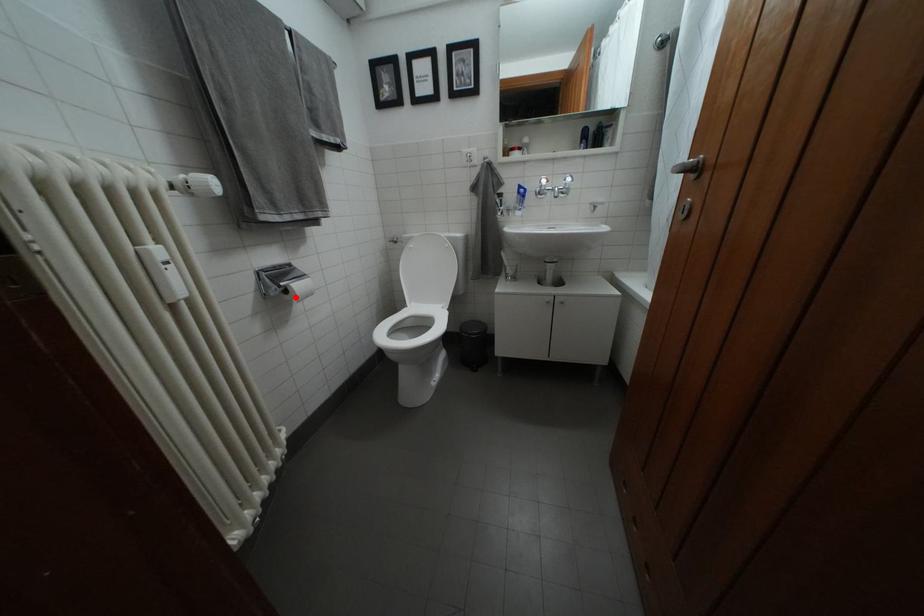
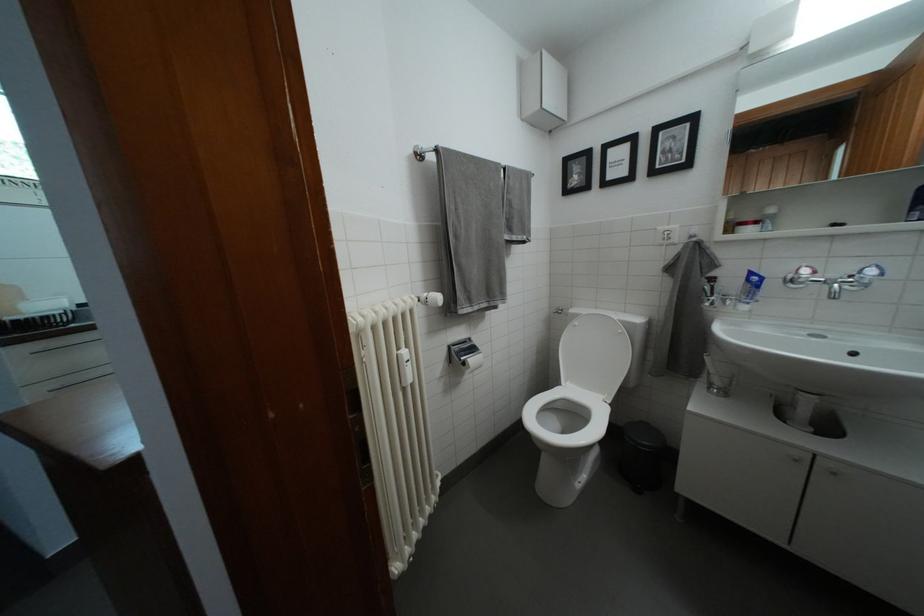
Where in the second image is the point corresponding to the highlighted location from the first image?

(472, 369)